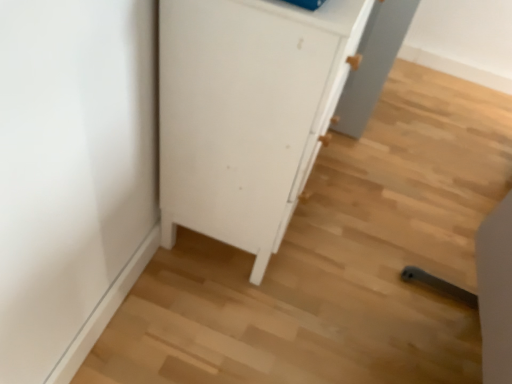
Where is `free space below light wood chair at lower right (from a real-world perspective)`? The width and height of the screenshot is (512, 384). free space below light wood chair at lower right (from a real-world perspective) is located at coordinates (439, 339).